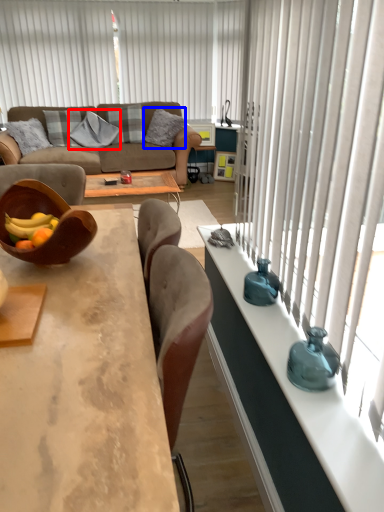
Question: Which of the following is the closest to the observer, pillow (highlighted by a red box) or pillow (highlighted by a blue box)?

Choices:
 (A) pillow
 (B) pillow

Answer: (B)